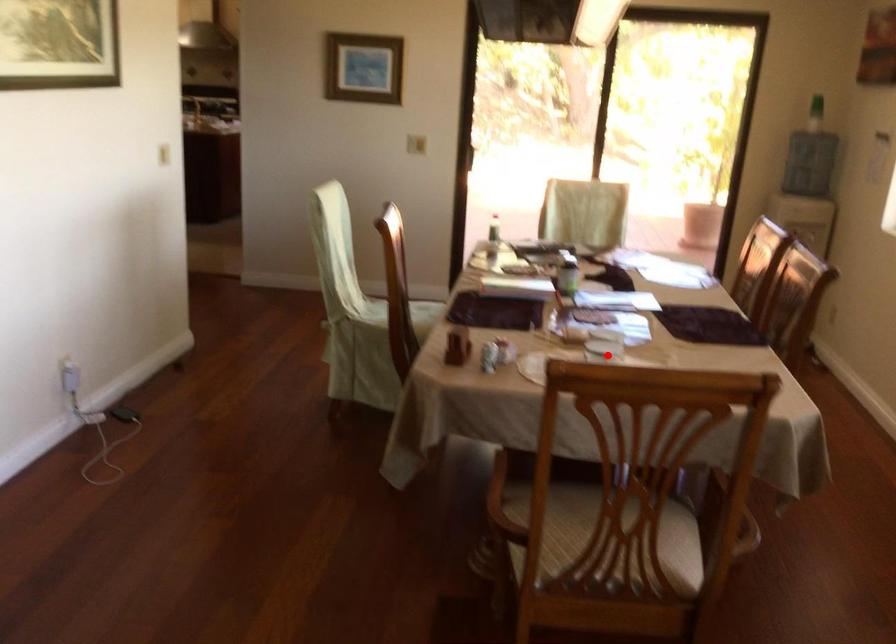
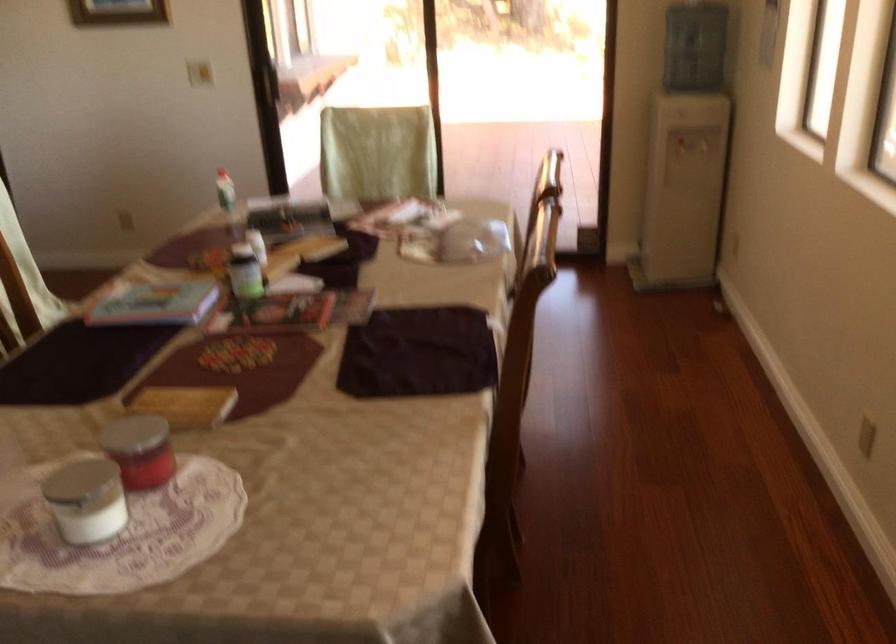
Find the pixel in the second image that matches the highlighted location in the first image.

(85, 500)